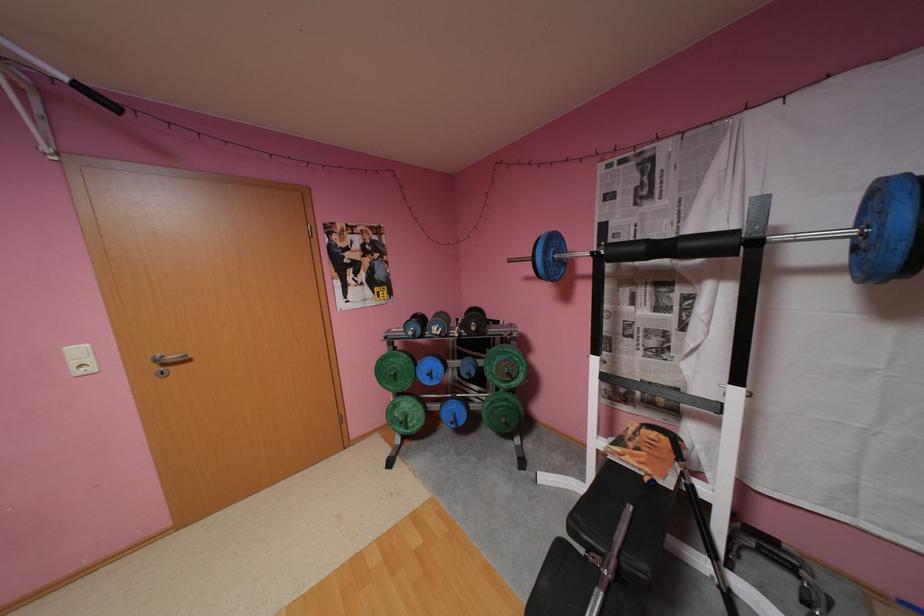
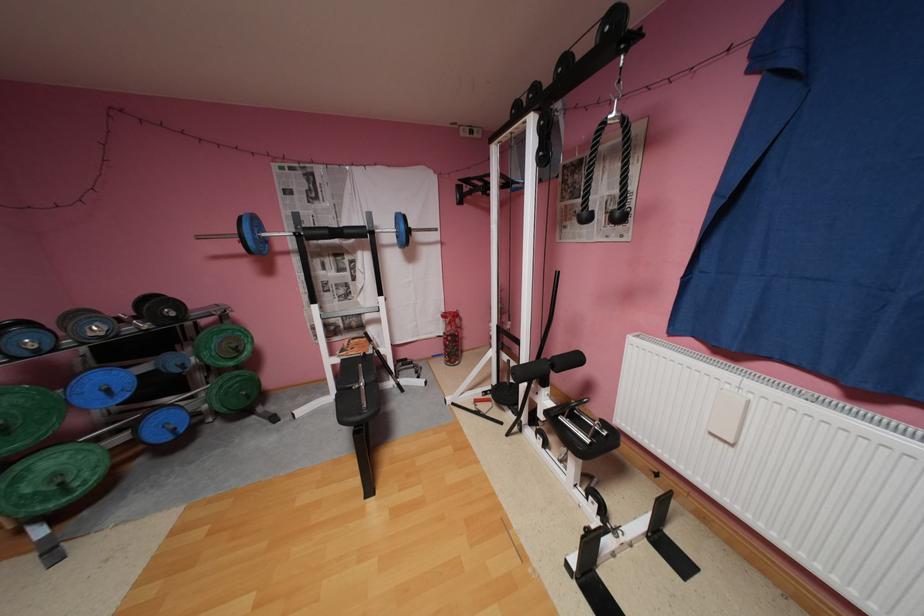
Question: Based on the continuous images, in which direction is the camera rotating? Reply with the corresponding letter.

Choices:
 (A) Left
 (B) Right
 (C) Up
 (D) Down

Answer: (B)